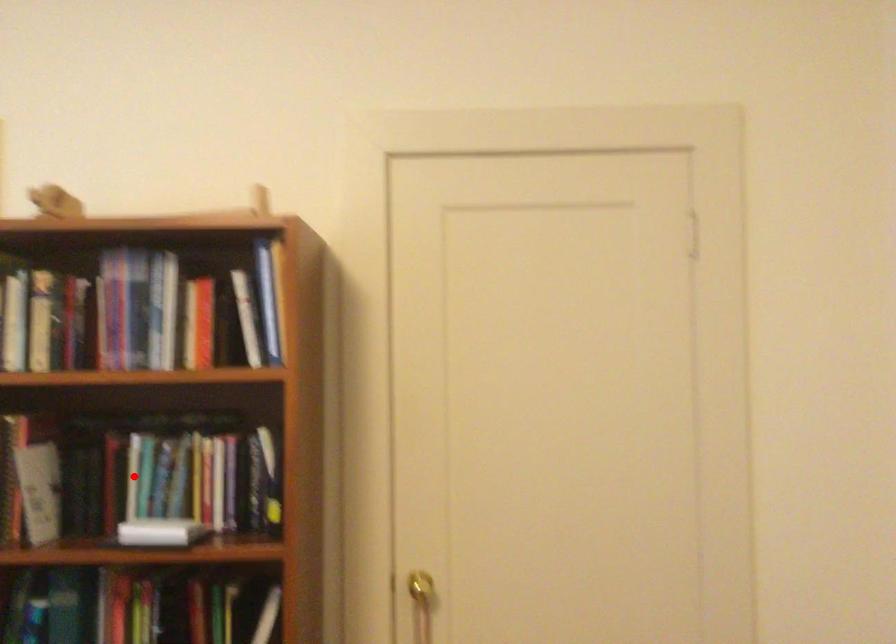
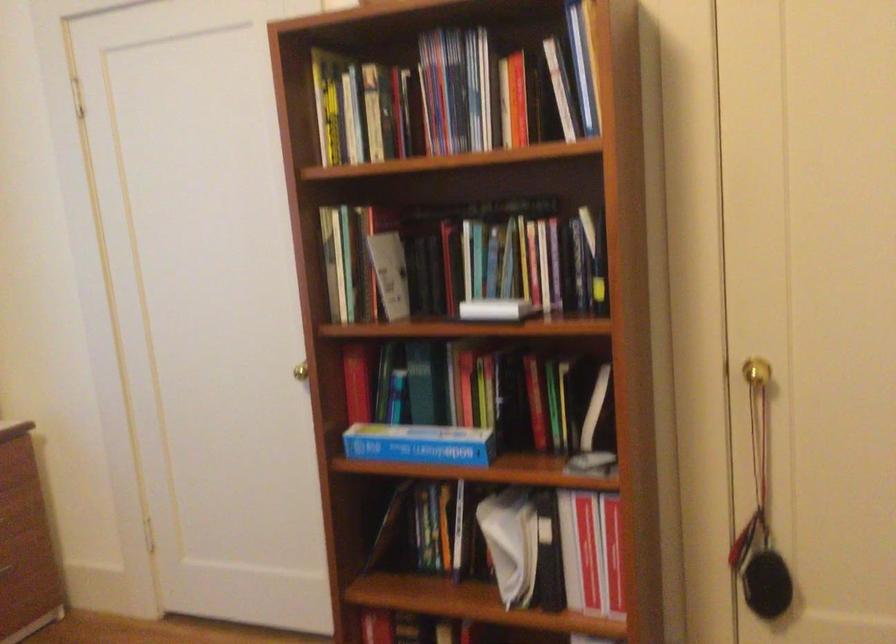
Where in the second image is the point corresponding to the highlighted location from the first image?

(467, 260)